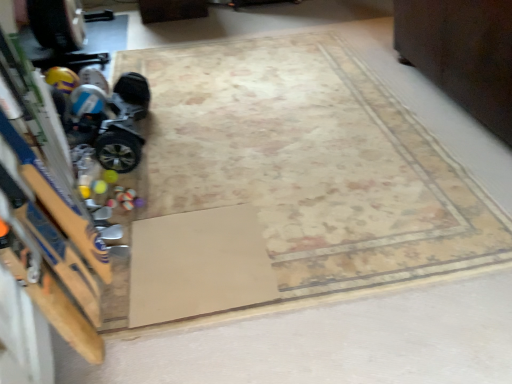
Question: Considering the relative positions of dark wood dresser at upper right and shiny metallic hoverboard at left in the image provided, is dark wood dresser at upper right to the right of shiny metallic hoverboard at left from the viewer's perspective?

Choices:
 (A) no
 (B) yes

Answer: (B)

Question: Does dark wood dresser at upper right have a greater width compared to shiny metallic hoverboard at left?

Choices:
 (A) yes
 (B) no

Answer: (A)

Question: Considering the relative sizes of dark wood dresser at upper right and shiny metallic hoverboard at left in the image provided, is dark wood dresser at upper right taller than shiny metallic hoverboard at left?

Choices:
 (A) no
 (B) yes

Answer: (B)

Question: From a real-world perspective, is dark wood dresser at upper right below shiny metallic hoverboard at left?

Choices:
 (A) no
 (B) yes

Answer: (A)

Question: Are dark wood dresser at upper right and shiny metallic hoverboard at left located far from each other?

Choices:
 (A) no
 (B) yes

Answer: (B)

Question: Does point (101, 162) appear closer or farther from the camera than point (326, 104)?

Choices:
 (A) closer
 (B) farther

Answer: (A)

Question: In the image, is shiny metallic hoverboard at left positioned in front of or behind beige carpet at center?

Choices:
 (A) front
 (B) behind

Answer: (B)

Question: Is shiny metallic hoverboard at left inside the boundaries of beige carpet at center, or outside?

Choices:
 (A) inside
 (B) outside

Answer: (B)

Question: Based on their positions, is shiny metallic hoverboard at left located to the left or right of beige carpet at center?

Choices:
 (A) left
 (B) right

Answer: (A)

Question: Relative to shiny metallic hoverboard at left, is dark wood dresser at upper right in front or behind?

Choices:
 (A) front
 (B) behind

Answer: (A)

Question: Is point (430, 23) closer or farther from the camera than point (122, 119)?

Choices:
 (A) farther
 (B) closer

Answer: (A)

Question: In the image, is dark wood dresser at upper right on the left side or the right side of shiny metallic hoverboard at left?

Choices:
 (A) right
 (B) left

Answer: (A)

Question: Which is correct: dark wood dresser at upper right is inside shiny metallic hoverboard at left, or outside of it?

Choices:
 (A) outside
 (B) inside

Answer: (A)

Question: Looking at the image, does dark wood dresser at upper right seem bigger or smaller compared to beige carpet at center?

Choices:
 (A) big
 (B) small

Answer: (A)

Question: From the image's perspective, is dark wood dresser at upper right located above or below beige carpet at center?

Choices:
 (A) below
 (B) above

Answer: (B)